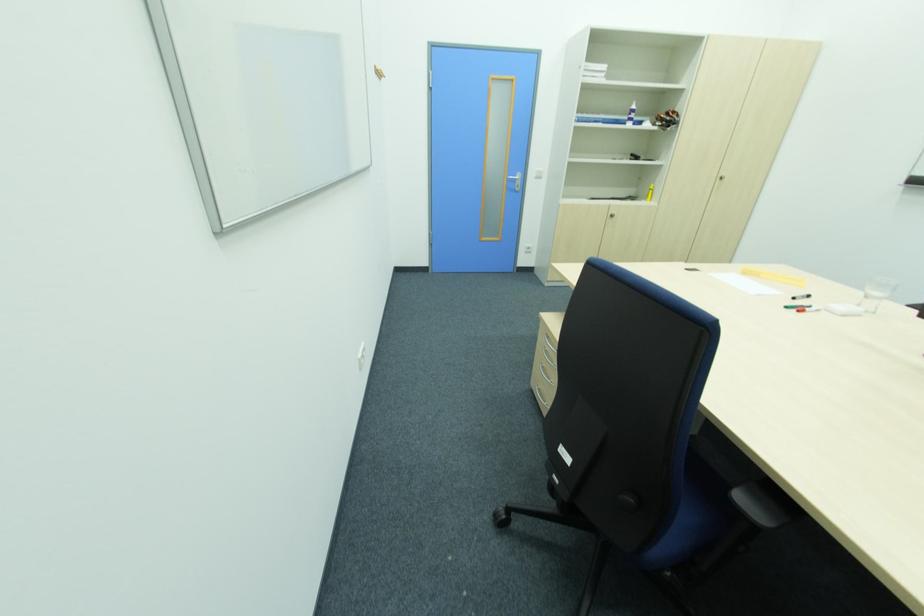
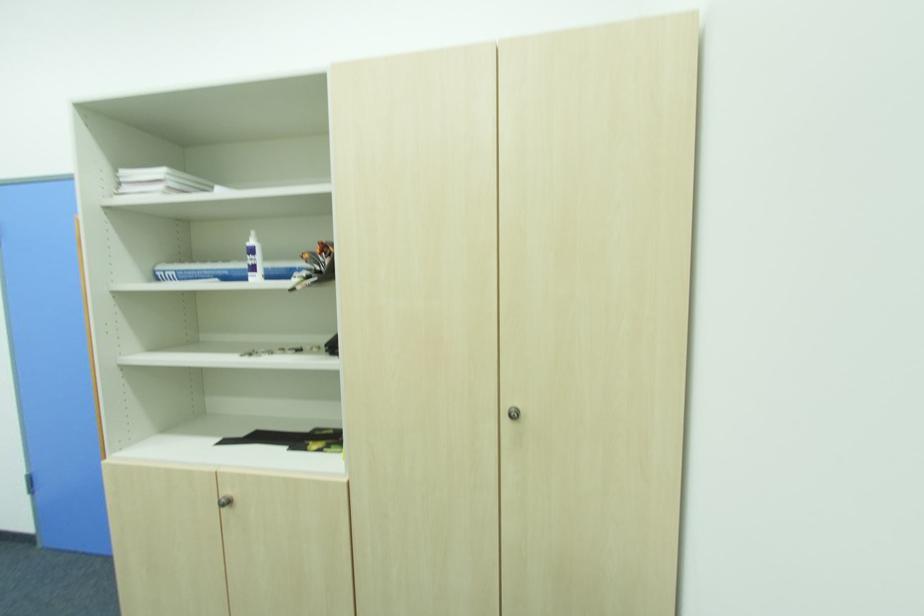
Find the pixel in the second image that matches point 614,217 in the first image.

(229, 504)